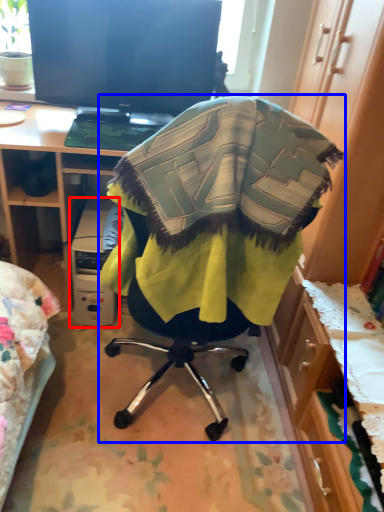
Question: Which point is closer to the camera, computer (highlighted by a red box) or chair (highlighted by a blue box)?

Choices:
 (A) computer
 (B) chair

Answer: (B)